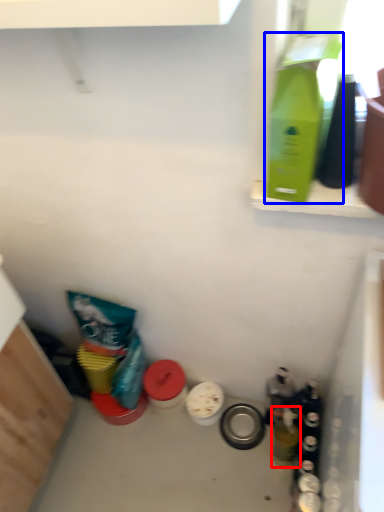
Question: Which object is further to the camera taking this photo, bottle (highlighted by a red box) or bottle (highlighted by a blue box)?

Choices:
 (A) bottle
 (B) bottle

Answer: (A)